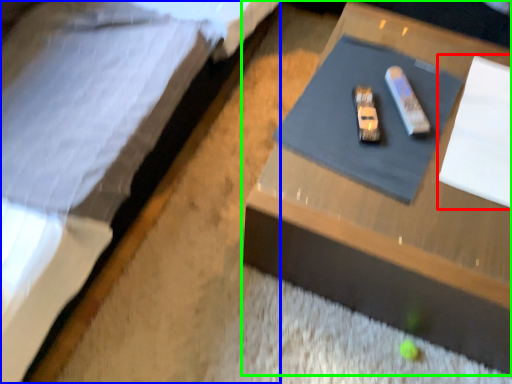
Question: Considering the real-world distances, which object is closest to notepad (highlighted by a red box)? bed (highlighted by a blue box) or table (highlighted by a green box).

Choices:
 (A) bed
 (B) table

Answer: (B)